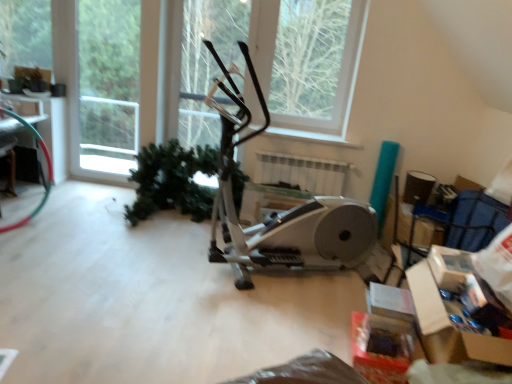
I want to click on vacant space to the right of wooden table at left, so click(80, 208).